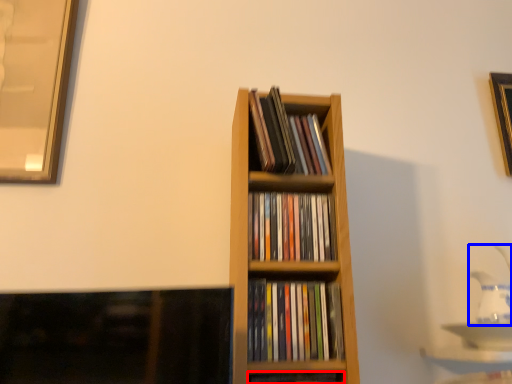
Question: Which object is further to the camera taking this photo, book (highlighted by a red box) or tea pot (highlighted by a blue box)?

Choices:
 (A) book
 (B) tea pot

Answer: (B)